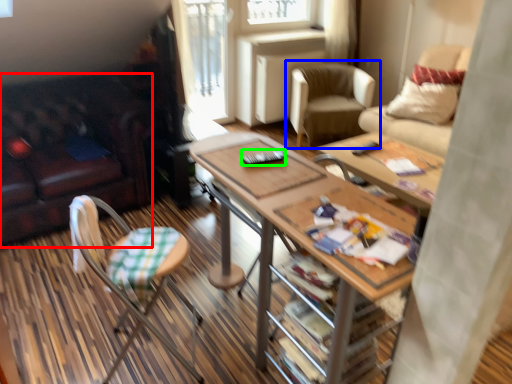
Question: Based on their relative distances, which object is nearer to studio couch (highlighted by a red box)? Choose from chair (highlighted by a blue box) and remote control (highlighted by a green box).

Choices:
 (A) chair
 (B) remote control

Answer: (B)